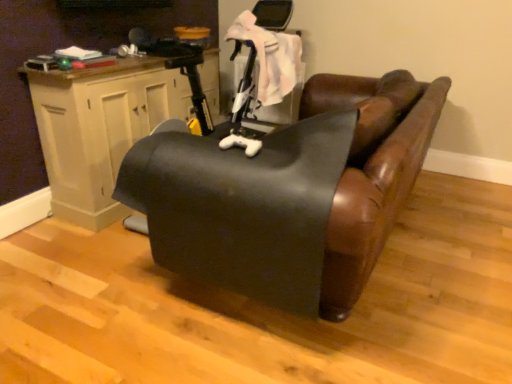
Describe the element at coordinates (290, 194) in the screenshot. The height and width of the screenshot is (384, 512). I see `black leather couch at center` at that location.

The width and height of the screenshot is (512, 384). I want to click on black leather couch at center, so click(x=290, y=194).

What do you see at coordinates (99, 129) in the screenshot? I see `wooden cabinet at left` at bounding box center [99, 129].

Based on the photo, measure the distance between point (68,129) and camera.

The distance of point (68,129) from camera is 7.34 feet.

I want to click on wooden cabinet at left, so click(x=99, y=129).

Locate an element on the screen. black leather couch at center is located at coordinates (290, 194).

Between wooden cabinet at left and black leather couch at center, which one appears on the right side from the viewer's perspective?

From the viewer's perspective, black leather couch at center appears more on the right side.

Is the depth of wooden cabinet at left less than that of black leather couch at center?

No, wooden cabinet at left is behind black leather couch at center.

From the picture: Which point is more distant from viewer, [120,68] or [400,166]?

The point [120,68] is farther from the camera.

From the image's perspective, is wooden cabinet at left over black leather couch at center?

Yes, from the image's perspective, wooden cabinet at left is on top of black leather couch at center.

From a real-world perspective, is wooden cabinet at left physically below black leather couch at center?

No, from a real-world perspective, wooden cabinet at left is not under black leather couch at center.

Does wooden cabinet at left have a lesser width compared to black leather couch at center?

Yes.

Considering the relative sizes of wooden cabinet at left and black leather couch at center in the image provided, is wooden cabinet at left taller than black leather couch at center?

Yes.

Who is bigger, wooden cabinet at left or black leather couch at center?

Bigger between the two is black leather couch at center.

Is wooden cabinet at left completely or partially outside of black leather couch at center?

That's correct, wooden cabinet at left is outside of black leather couch at center.

Is wooden cabinet at left far away from black leather couch at center?

No, there isn't a large distance between wooden cabinet at left and black leather couch at center.

Is wooden cabinet at left positioned with its back to black leather couch at center?

wooden cabinet at left does not have its back to black leather couch at center.

Find the location of a particular element. furniture that appears below the wooden cabinet at left (from the image's perspective) is located at coordinates (290, 194).

In the scene shown: Based on their positions, is black leather couch at center located to the left or right of wooden cabinet at left?

black leather couch at center is to the right of wooden cabinet at left.

Which object is closer to the camera, black leather couch at center or wooden cabinet at left?

black leather couch at center.

Considering the positions of point (194, 233) and point (157, 75), is point (194, 233) closer or farther from the camera than point (157, 75)?

Clearly, point (194, 233) is closer to the camera than point (157, 75).

From the image's perspective, is black leather couch at center located above wooden cabinet at left?

No.

From a real-world perspective, is black leather couch at center located beneath wooden cabinet at left?

Indeed, from a real-world perspective, black leather couch at center is positioned beneath wooden cabinet at left.

Which of these two, black leather couch at center or wooden cabinet at left, is wider?

black leather couch at center.

Can you confirm if black leather couch at center is taller than wooden cabinet at left?

In fact, black leather couch at center may be shorter than wooden cabinet at left.

Considering the sizes of black leather couch at center and wooden cabinet at left in the image, is black leather couch at center bigger or smaller than wooden cabinet at left?

black leather couch at center is bigger than wooden cabinet at left.

Does black leather couch at center contain wooden cabinet at left?

No, wooden cabinet at left is not inside black leather couch at center.

Is black leather couch at center touching wooden cabinet at left?

black leather couch at center and wooden cabinet at left are clearly separated.

Based on the photo, is black leather couch at center oriented away from wooden cabinet at left?

Yes.

How far apart are black leather couch at center and wooden cabinet at left?

The distance of black leather couch at center from wooden cabinet at left is 98.79 centimeters.

This screenshot has width=512, height=384. In order to click on furniture below the wooden cabinet at left (from a real-world perspective) in this screenshot , I will do 290,194.

I want to click on furniture that is on the right side of wooden cabinet at left, so click(290, 194).

Find the location of a particular element. furniture that appears below the wooden cabinet at left (from the image's perspective) is located at coordinates (290, 194).